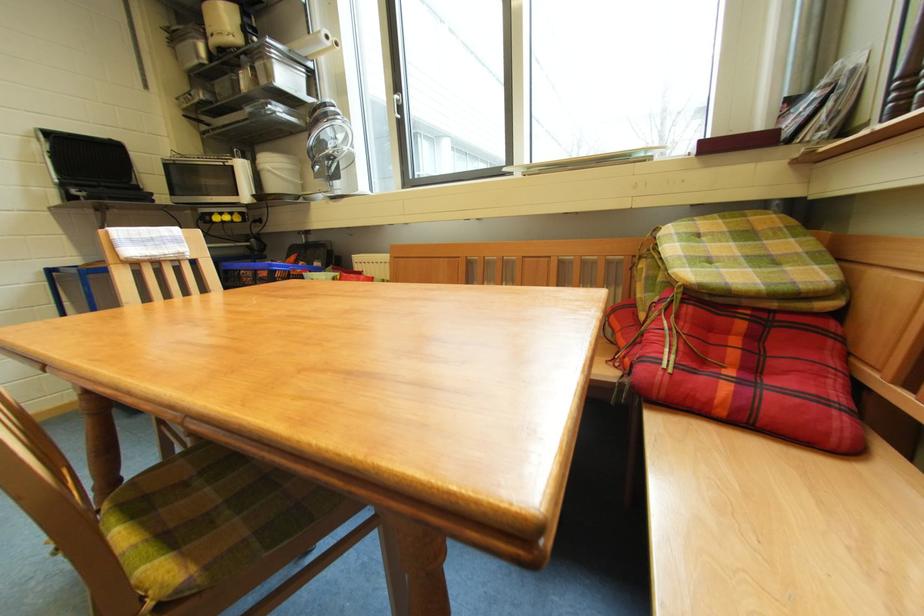
At what (x,y) coordinates should I click in order to perform the action: click on chair sitting surface. Please return your answer as a coordinate pair (x, y). Image resolution: width=924 pixels, height=616 pixels. Looking at the image, I should click on (179, 509).